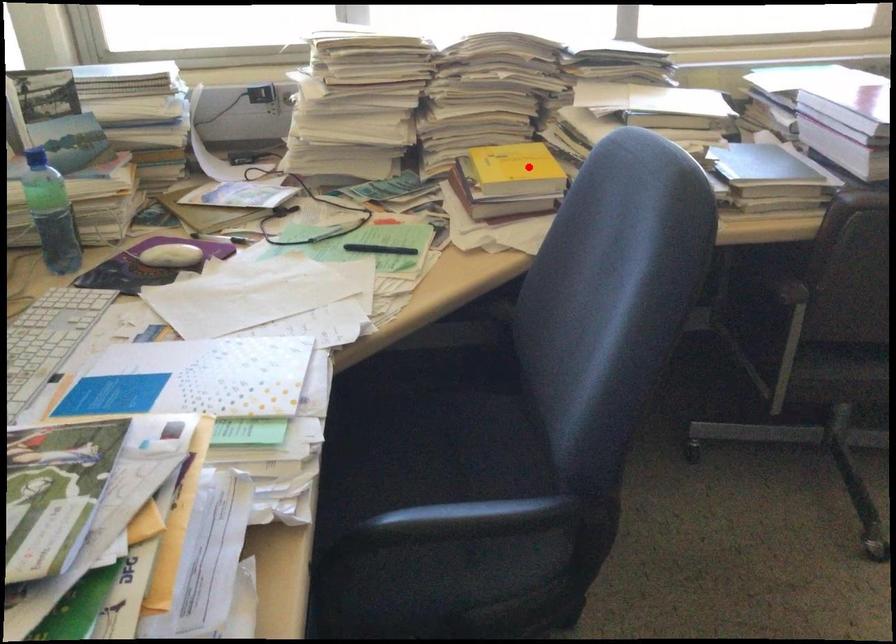
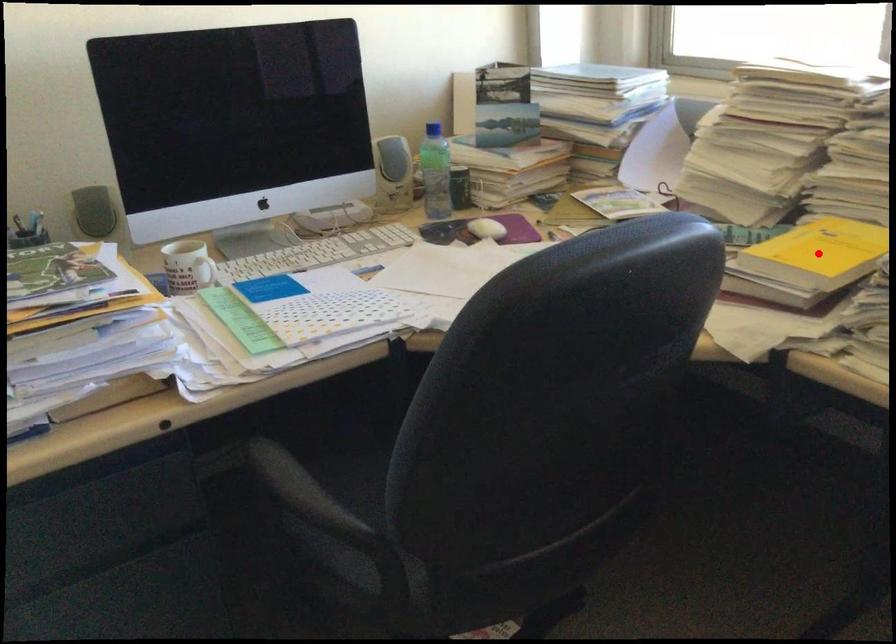
I am providing you with two images of the same scene from different viewpoints. A red point is marked on the first image and another point is marked on the second image. Does the point marked in image1 correspond to the same location as the one in image2?

Yes